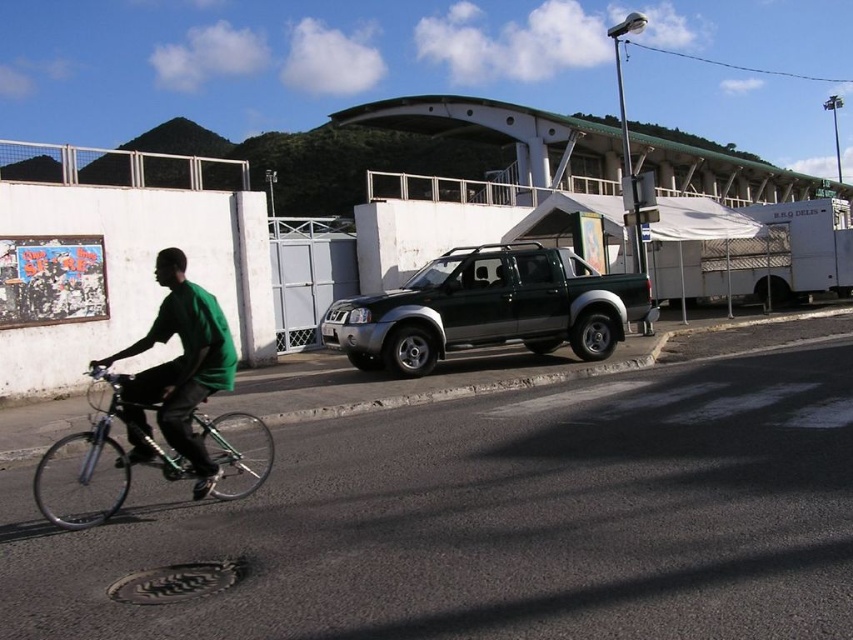
From the picture: Between green matte truck at center and shiny metallic bicycle at lower left, which one has more height?

shiny metallic bicycle at lower left is taller.

Between point (401, 312) and point (212, 424), which one is positioned behind?

Point (401, 312)

Is point (471, 310) positioned before point (105, 433)?

No, (471, 310) is further to viewer.

This screenshot has width=853, height=640. I want to click on green matte truck at center, so click(x=488, y=308).

Does green matte truck at center appear on the left side of green matte shirt at left?

Incorrect, green matte truck at center is not on the left side of green matte shirt at left.

Locate an element on the screen. green matte truck at center is located at coordinates (488, 308).

Locate an element on the screen. green matte truck at center is located at coordinates (488, 308).

Can you confirm if shiny metallic bicycle at lower left is positioned to the left of green matte shirt at left?

Yes, shiny metallic bicycle at lower left is to the left of green matte shirt at left.

Does shiny metallic bicycle at lower left appear on the right side of green matte shirt at left?

Incorrect, shiny metallic bicycle at lower left is not on the right side of green matte shirt at left.

Where is `shiny metallic bicycle at lower left`? shiny metallic bicycle at lower left is located at coordinates (86, 467).